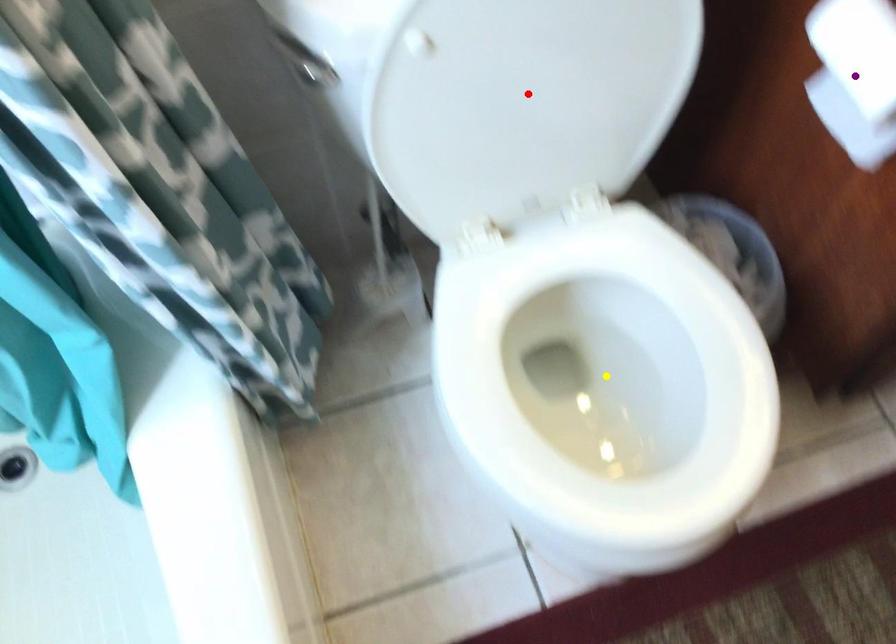
Order these from nearest to farthest:
1. red point
2. purple point
3. yellow point

purple point
red point
yellow point